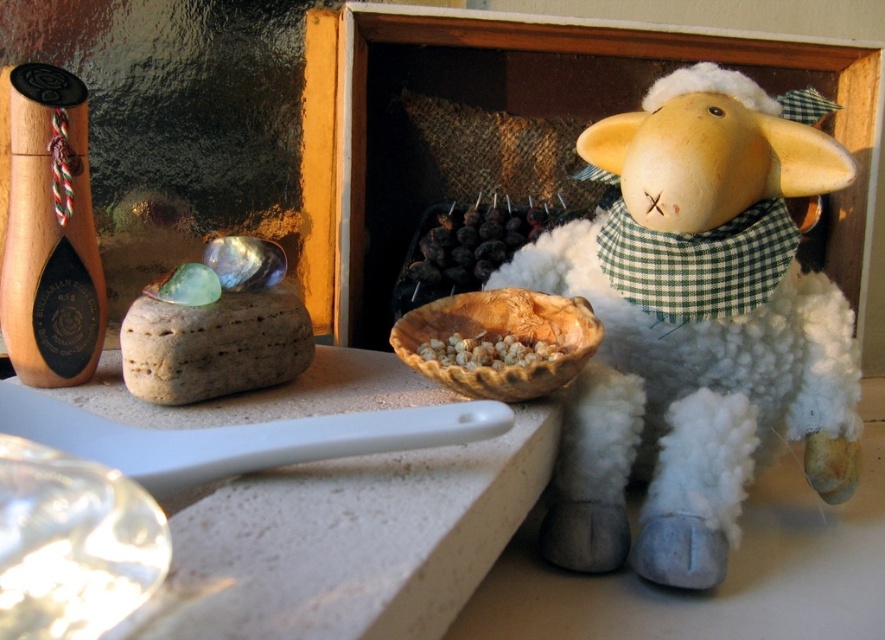
Question: Does brown textured rock at left appear over brown grainy bowl at center?

Choices:
 (A) no
 (B) yes

Answer: (B)

Question: Estimate the real-world distances between objects in this image. Which object is closer to the white plush sheep at right?

Choices:
 (A) brown textured rock at left
 (B) brown grainy bowl at center
 (C) dark purple grapes at center

Answer: (B)

Question: Which point is closer to the camera taking this photo?

Choices:
 (A) (506, 240)
 (B) (258, 301)

Answer: (B)

Question: Does dark purple grapes at center appear over brown grainy bowl at center?

Choices:
 (A) no
 (B) yes

Answer: (B)

Question: Can you confirm if white plush sheep at right is bigger than brown grainy bowl at center?

Choices:
 (A) yes
 (B) no

Answer: (A)

Question: Which point is farther to the camera?

Choices:
 (A) click(x=436, y=269)
 (B) click(x=696, y=176)

Answer: (A)